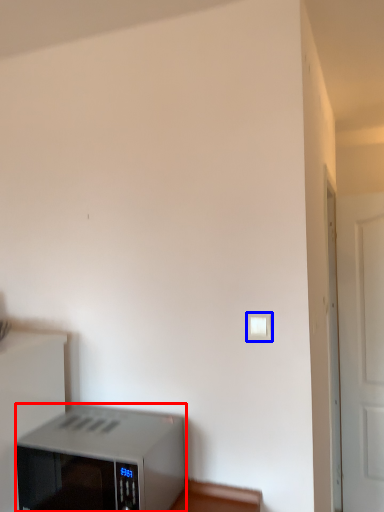
Question: Among these objects, which one is nearest to the camera, home appliance (highlighted by a red box) or light switch (highlighted by a blue box)?

Choices:
 (A) home appliance
 (B) light switch

Answer: (A)